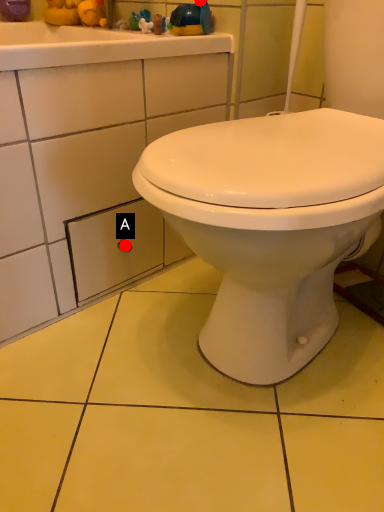
Question: Two points are circled on the image, labeled by A and B beside each circle. Which of the following is the closest to the observer?

Choices:
 (A) A is closer
 (B) B is closer

Answer: (B)